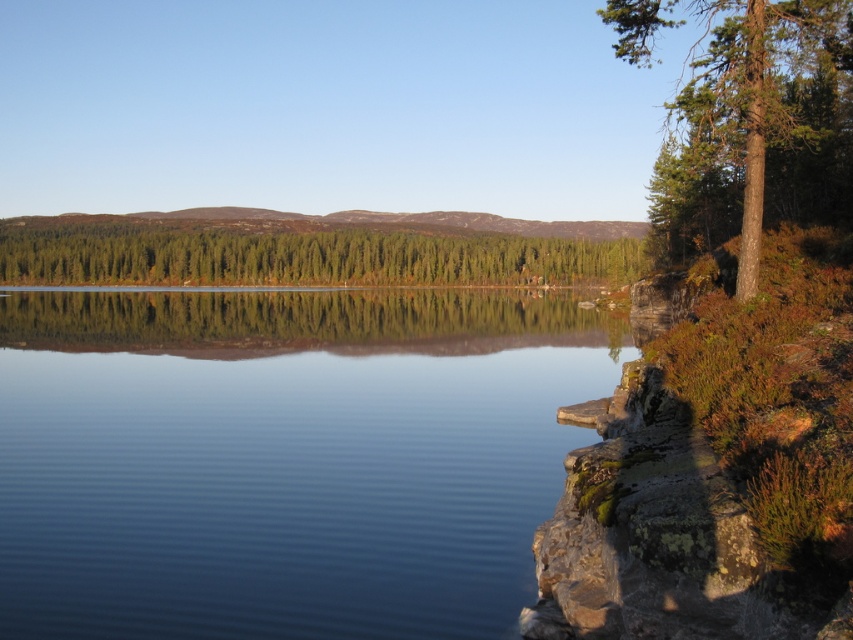
Is clear water at center wider than green matte forest at center?

No.

Does clear water at center appear on the left side of green matte forest at center?

Incorrect, clear water at center is not on the left side of green matte forest at center.

Between point (408, 371) and point (84, 234), which one is positioned behind?

Positioned behind is point (84, 234).

Where is `clear water at center`? This screenshot has width=853, height=640. clear water at center is located at coordinates (283, 460).

Is brown textured tree at right above green matte forest at center?

Correct, brown textured tree at right is located above green matte forest at center.

Is brown textured tree at right shorter than green matte forest at center?

No, brown textured tree at right is not shorter than green matte forest at center.

Is point (747, 10) closer to camera compared to point (251, 278)?

Yes.

Locate an element on the screen. Image resolution: width=853 pixels, height=640 pixels. brown textured tree at right is located at coordinates (759, 129).

Who is more forward, (526,536) or (792,134)?

Point (526,536) is more forward.

Looking at this image, is clear water at center smaller than brown textured tree at right?

Indeed, clear water at center has a smaller size compared to brown textured tree at right.

You are a GUI agent. You are given a task and a screenshot of the screen. Output one action in this format:
    pyautogui.click(x=<x>, y=<y>)
    Task: Click on the clear water at center
    The height and width of the screenshot is (640, 853).
    Given the screenshot: What is the action you would take?
    pyautogui.click(x=283, y=460)